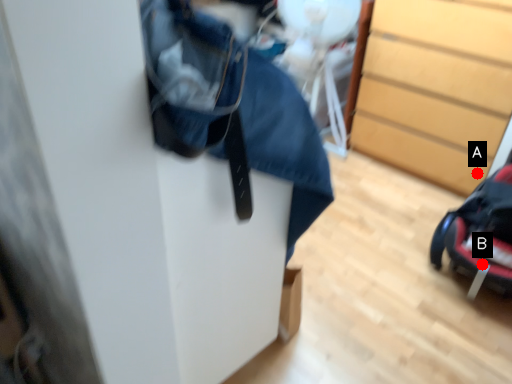
Question: Two points are circled on the image, labeled by A and B beside each circle. Which of the following is the closest to the observer?

Choices:
 (A) A is closer
 (B) B is closer

Answer: (B)